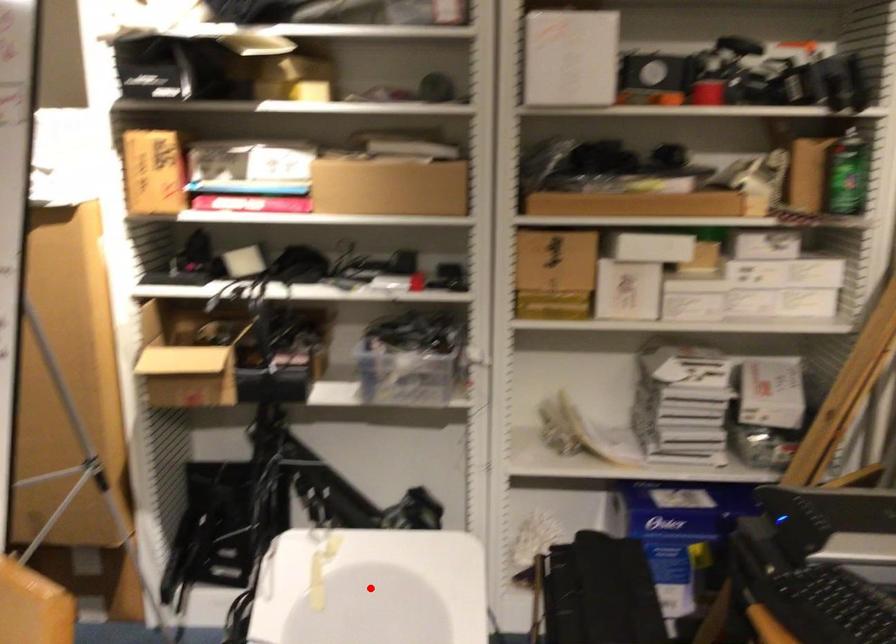
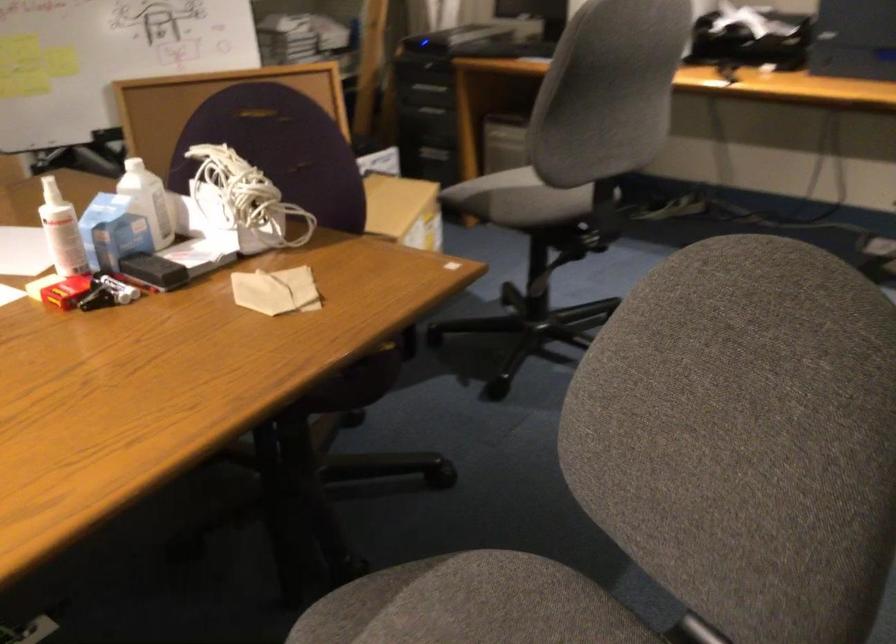
Question: I am providing you with two images of the same scene from different viewpoints. A red point is marked on the first image. Is the red point's position out of view in image 2?

Choices:
 (A) Yes
 (B) No

Answer: (A)